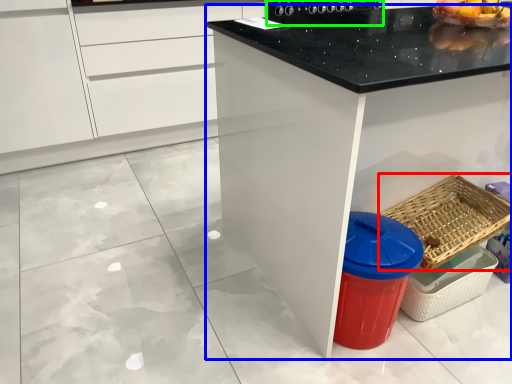
Question: Based on their relative distances, which object is farther from basket (highlighted by a red box)? Choose from countertop (highlighted by a blue box) and appliance (highlighted by a green box).

Choices:
 (A) countertop
 (B) appliance

Answer: (B)